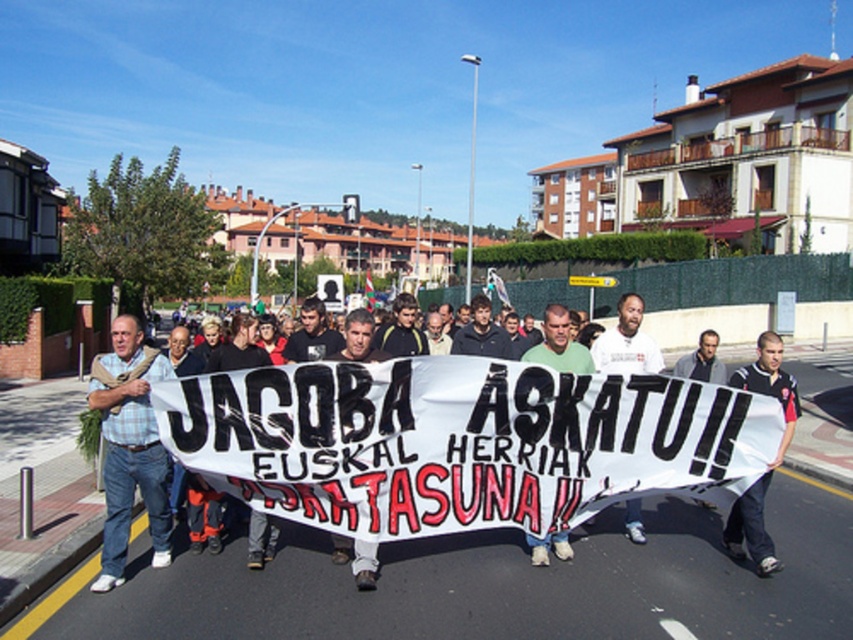
Who is taller, white cotton t-shirt at center or dark gray shirt at center?

With more height is white cotton t-shirt at center.

Which is in front, point (625, 339) or point (502, 342)?

Point (625, 339) is more forward.

Is point (595, 364) more distant than point (474, 314)?

No, it is in front of (474, 314).

Find the location of a particular element. The image size is (853, 640). white cotton t-shirt at center is located at coordinates (625, 342).

Is black jersey at center further to camera compared to green cotton shirt at center?

No.

Does point (779, 401) come in front of point (579, 352)?

That is True.

Identify the location of black jersey at center. This screenshot has height=640, width=853. (770, 464).

From the picture: Is plaid shirt at left above black jersey at center?

Actually, plaid shirt at left is below black jersey at center.

Between plaid shirt at left and black jersey at center, which one appears on the left side from the viewer's perspective?

From the viewer's perspective, plaid shirt at left appears more on the left side.

Is point (143, 492) positioned after point (798, 416)?

No, (143, 492) is closer to viewer.

I want to click on plaid shirt at left, so click(129, 448).